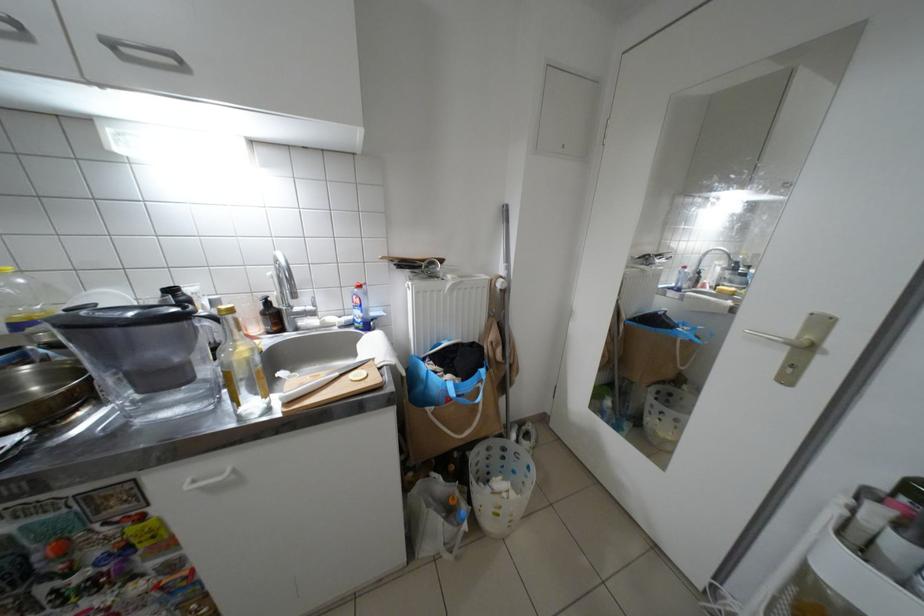
Find the location of `brown bag handle`. brown bag handle is located at coordinates (455, 424).